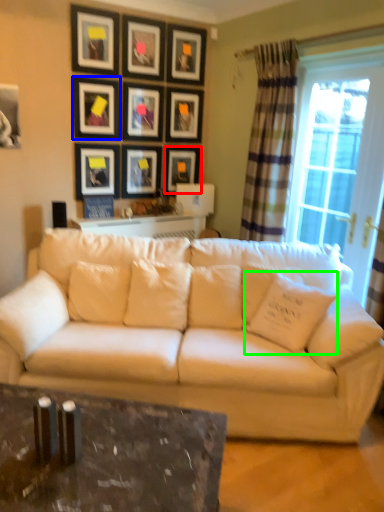
Question: Considering the real-world distances, which object is farthest from picture frame (highlighted by a red box)? picture frame (highlighted by a blue box) or pillow (highlighted by a green box)?

Choices:
 (A) picture frame
 (B) pillow

Answer: (B)